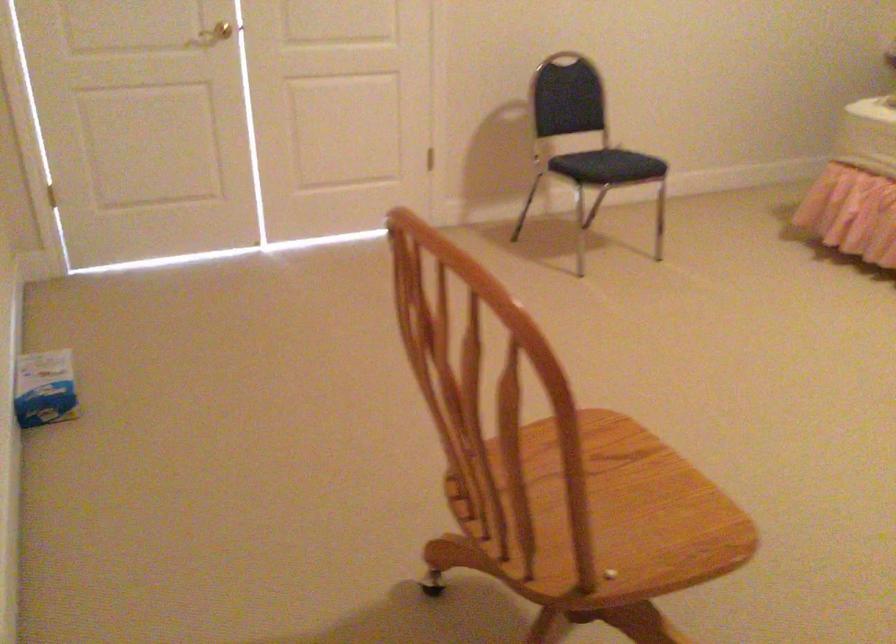
Find where to lift the small cardboard box. Please return your answer as a coordinate pair (x, y).

(45, 388)